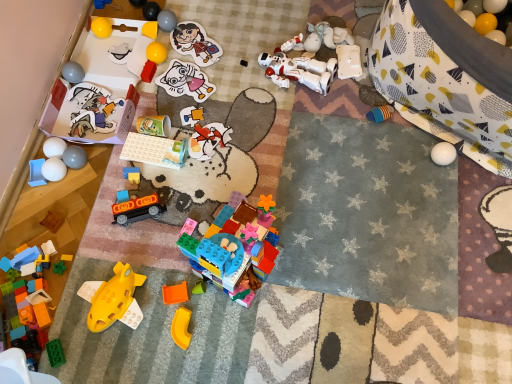
Identify the location of free area in between yellow rubber ball at upper right, arranged as the 25th toy when viewed from the left, and matte blue plastic toy at center, marked as the thirteenth toy in a right-to-left arrangement. Image resolution: width=512 pixels, height=384 pixels. (265, 127).